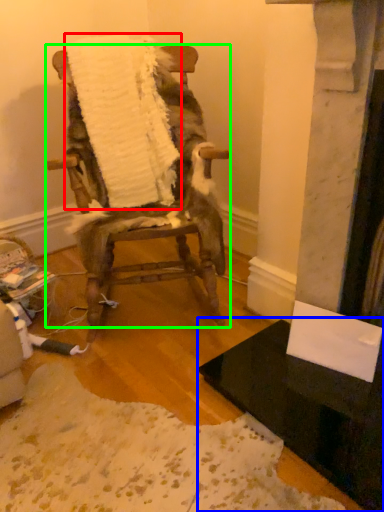
Question: Estimate the real-world distances between objects in this image. Which object is closer to blanket (highlighted by a red box), table (highlighted by a blue box) or chair (highlighted by a green box)?

Choices:
 (A) table
 (B) chair

Answer: (B)